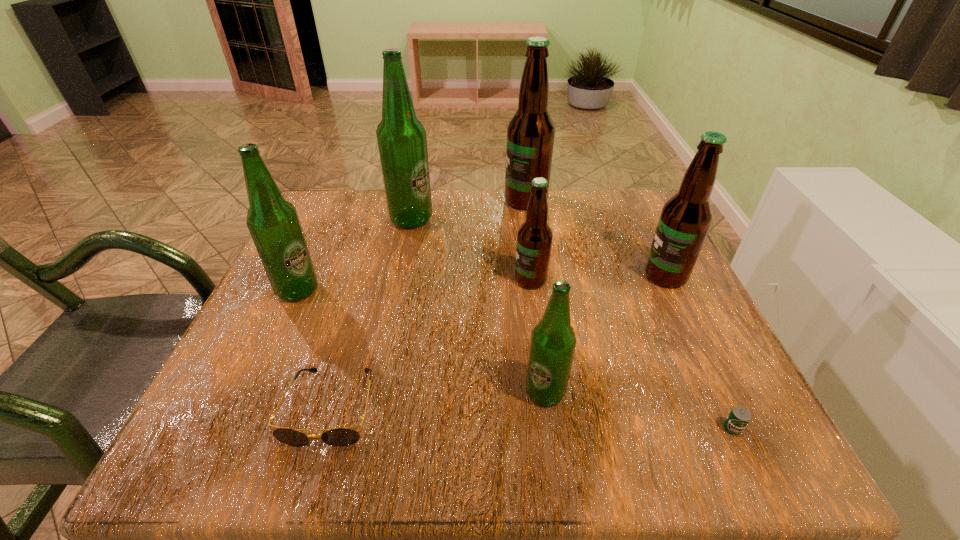
Choose which object is the fourth nearest neighbor to the leftmost beer bottle. Please provide its 2D coordinates. Your answer should be formatted as a tuple, i.e. [(x, y)], where the tuple contains the x and y coordinates of a point satisfying the conditions above.

[(553, 341)]

The image size is (960, 540). What are the coordinates of `beer bottle that stands as the closest to the nearest beer bottle` in the screenshot? It's located at (534, 238).

Locate which beer bottle ranks second in proximity to the smallest brown beer bottle. Please provide its 2D coordinates. Your answer should be formatted as a tuple, i.e. [(x, y)], where the tuple contains the x and y coordinates of a point satisfying the conditions above.

[(553, 341)]

I want to click on the closest brown beer bottle to the rightmost green beer bottle, so click(534, 238).

Select which brown beer bottle is the second closest to the smallest brown beer bottle. Please provide its 2D coordinates. Your answer should be formatted as a tuple, i.e. [(x, y)], where the tuple contains the x and y coordinates of a point satisfying the conditions above.

[(531, 131)]

Choose which green beer bottle is the second nearest neighbor to the sunglasses. Please provide its 2D coordinates. Your answer should be formatted as a tuple, i.e. [(x, y)], where the tuple contains the x and y coordinates of a point satisfying the conditions above.

[(553, 341)]

Identify which green beer bottle is located as the nearest to the second nearest green beer bottle. Please provide its 2D coordinates. Your answer should be formatted as a tuple, i.e. [(x, y)], where the tuple contains the x and y coordinates of a point satisfying the conditions above.

[(402, 143)]

Where is `free region that satisfies the following two spatial constraints: 1. on the label of the smallest brown beer bottle; 2. on the label of the rightmost green beer bottle`? The image size is (960, 540). free region that satisfies the following two spatial constraints: 1. on the label of the smallest brown beer bottle; 2. on the label of the rightmost green beer bottle is located at coordinates (545, 392).

Find the location of a particular element. This screenshot has height=540, width=960. vacant area in the image that satisfies the following two spatial constraints: 1. on the label of the second biggest brown beer bottle; 2. on the front side of the beer can is located at coordinates (739, 428).

Locate an element on the screen. This screenshot has width=960, height=540. vacant region that satisfies the following two spatial constraints: 1. on the label of the farthest brown beer bottle; 2. on the front-facing side of the black sunglasses is located at coordinates (557, 407).